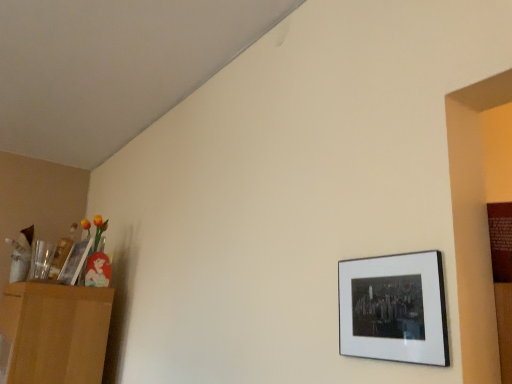
Question: From the image's perspective, is matte black picture frame at lower right, marked as the 1th picture frame in a front-to-back arrangement, below wooden picture frame at left, which ranks as the 1th picture frame in left-to-right order?

Choices:
 (A) yes
 (B) no

Answer: (B)

Question: Could you tell me if matte black picture frame at lower right, positioned as the 2th picture frame in left-to-right order, is turned towards wooden picture frame at left, positioned as the first picture frame in back-to-front order?

Choices:
 (A) yes
 (B) no

Answer: (B)

Question: From a real-world perspective, does matte black picture frame at lower right, positioned as the 2th picture frame in left-to-right order, sit lower than wooden picture frame at left, arranged as the 2th picture frame when viewed from the front?

Choices:
 (A) no
 (B) yes

Answer: (B)

Question: Is matte black picture frame at lower right, the second picture frame when ordered from back to front, thinner than wooden picture frame at left, arranged as the 2th picture frame when viewed from the front?

Choices:
 (A) no
 (B) yes

Answer: (B)

Question: Would you say wooden picture frame at left, which ranks as the 1th picture frame in left-to-right order, is part of matte black picture frame at lower right, marked as the 1th picture frame in a front-to-back arrangement,'s contents?

Choices:
 (A) yes
 (B) no

Answer: (B)

Question: Considering the relative sizes of matte black picture frame at lower right, the second picture frame when ordered from back to front, and wooden picture frame at left, the 2th picture frame from the right, in the image provided, is matte black picture frame at lower right, the second picture frame when ordered from back to front, shorter than wooden picture frame at left, the 2th picture frame from the right,?

Choices:
 (A) yes
 (B) no

Answer: (A)

Question: From the image's perspective, is light brown wooden dresser at left above matte black picture frame at lower right, the second picture frame when ordered from back to front?

Choices:
 (A) yes
 (B) no

Answer: (B)

Question: Considering the relative sizes of light brown wooden dresser at left and matte black picture frame at lower right, positioned as the 2th picture frame in left-to-right order, in the image provided, is light brown wooden dresser at left wider than matte black picture frame at lower right, positioned as the 2th picture frame in left-to-right order,?

Choices:
 (A) no
 (B) yes

Answer: (B)

Question: Is light brown wooden dresser at left looking in the opposite direction of matte black picture frame at lower right, positioned as the 2th picture frame in left-to-right order?

Choices:
 (A) no
 (B) yes

Answer: (A)

Question: Is light brown wooden dresser at left not close to matte black picture frame at lower right, the second picture frame when ordered from back to front?

Choices:
 (A) yes
 (B) no

Answer: (A)

Question: Considering the relative positions of light brown wooden dresser at left and matte black picture frame at lower right, the second picture frame when ordered from back to front, in the image provided, is light brown wooden dresser at left to the right of matte black picture frame at lower right, the second picture frame when ordered from back to front, from the viewer's perspective?

Choices:
 (A) yes
 (B) no

Answer: (B)

Question: Is light brown wooden dresser at left placed right next to matte black picture frame at lower right, positioned as the 1th picture frame in right-to-left order?

Choices:
 (A) yes
 (B) no

Answer: (B)

Question: Considering the relative positions of wooden picture frame at left, which ranks as the 1th picture frame in left-to-right order, and light brown wooden dresser at left in the image provided, is wooden picture frame at left, which ranks as the 1th picture frame in left-to-right order, to the left of light brown wooden dresser at left from the viewer's perspective?

Choices:
 (A) no
 (B) yes

Answer: (A)